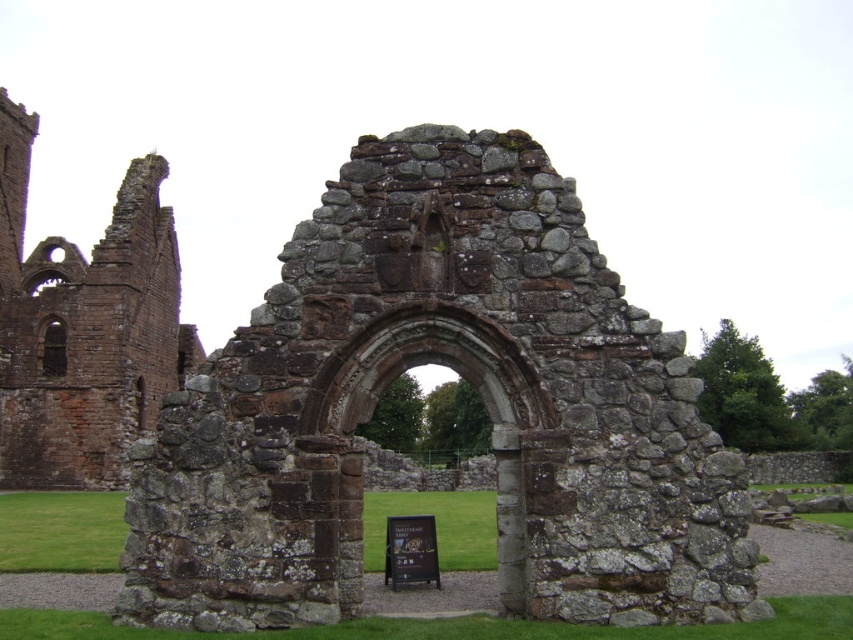
Where is `brown stone arch at center`? This screenshot has height=640, width=853. brown stone arch at center is located at coordinates (465, 378).

Can you confirm if brown stone arch at left is smaller than wooden signboard at center?

No, brown stone arch at left is not smaller than wooden signboard at center.

Between point (170, 388) and point (434, 524), which one is positioned in front?

Positioned in front is point (434, 524).

Find the location of `brown stone arch at left`. brown stone arch at left is located at coordinates (84, 326).

At what (x,y) coordinates should I click in order to perform the action: click on brown stone arch at left. Please return your answer as a coordinate pair (x, y). Looking at the image, I should click on (84, 326).

Which is behind, point (164, 480) or point (523, 486)?

Point (164, 480)

The width and height of the screenshot is (853, 640). Identify the location of brown stone arch at center. (465, 378).